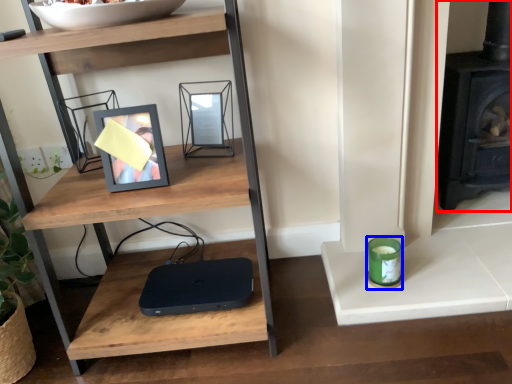
Question: Which point is further to the camera, fireplace (highlighted by a red box) or candle holder (highlighted by a blue box)?

Choices:
 (A) fireplace
 (B) candle holder

Answer: (A)